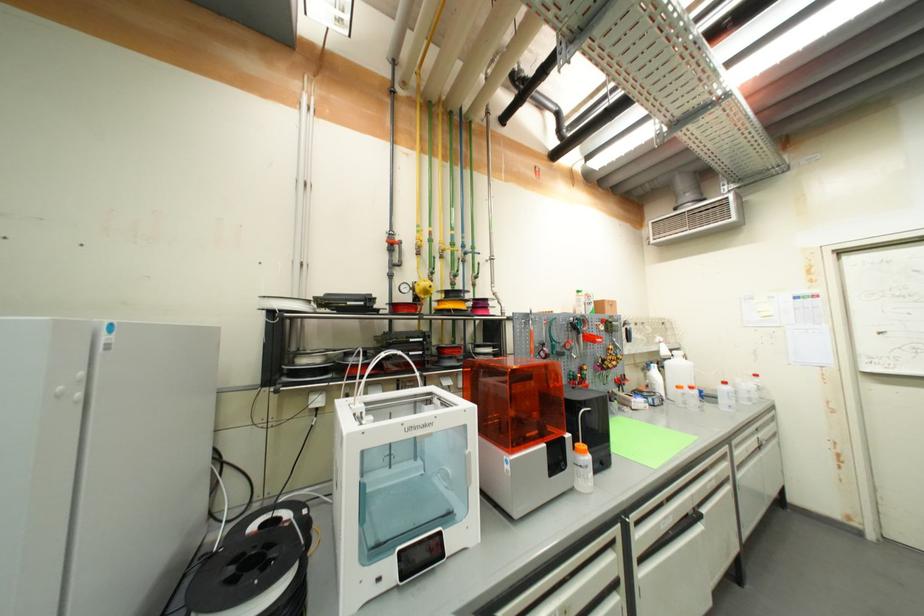
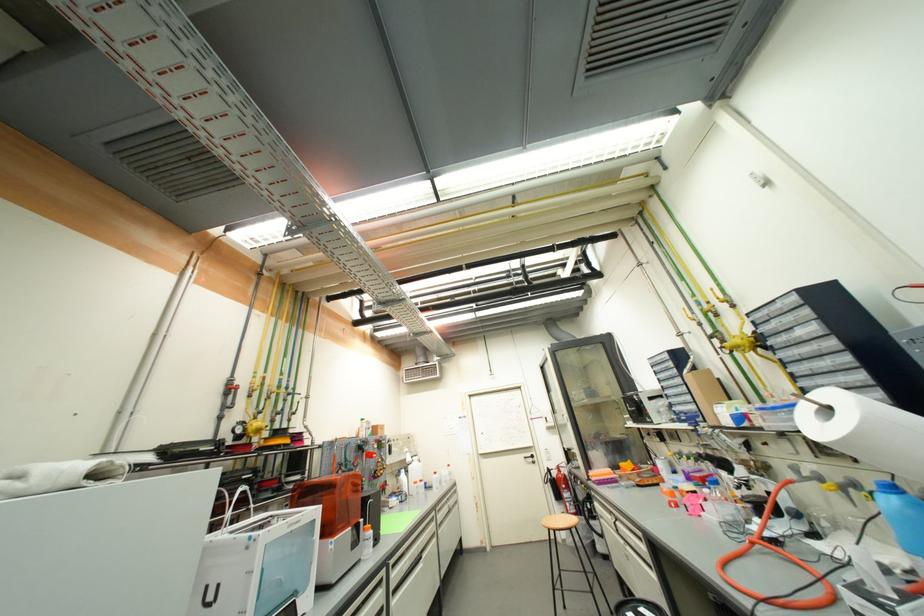
In the second image, find the point that corresponds to (743,464) in the first image.

(444, 525)